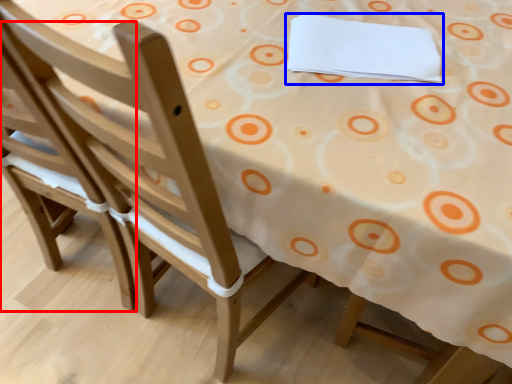
Question: Which point is closer to the camera, chair (highlighted by a red box) or notepad (highlighted by a blue box)?

Choices:
 (A) chair
 (B) notepad

Answer: (A)